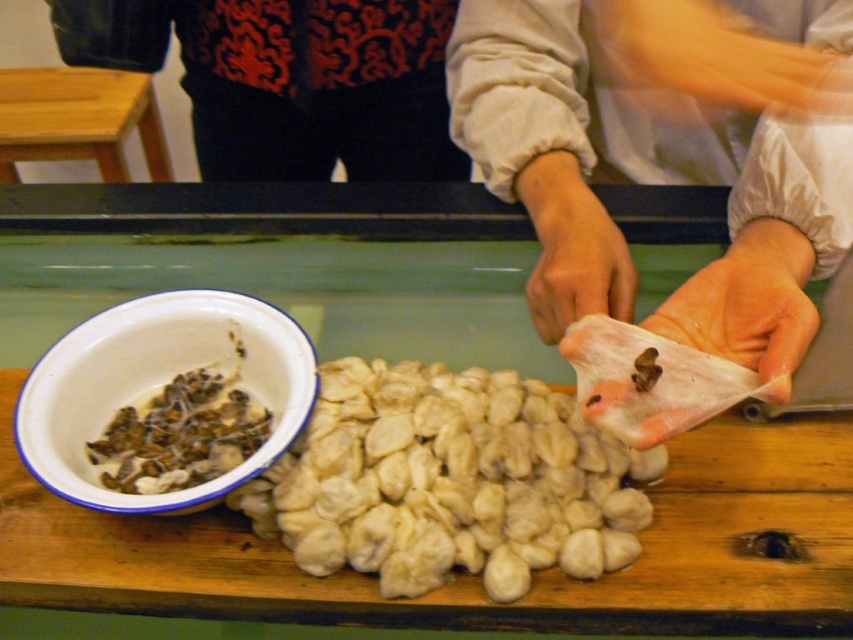
From the picture: You are a food photographer standing 1 meter away from the white enamel bowl at lower left. Can you capture the bowl in your shot without moving your camera?

The white enamel bowl at lower left is 58.75 centimeters away from camera, which is within the 1 meter distance you are standing. Therefore, you can capture the bowl in your shot without moving your camera.

You are a chef standing at the wooden table at left and need to grab the white enamel bowl at lower left to get some filling. Can you reach it without moving your position?

The white enamel bowl at lower left is 1.37 meters away from the wooden table at left. Since the average human arm length is about 0.7 meters, you cannot reach the white enamel bowl at lower left from the wooden table at left without moving.

You are trying to locate the patterned fabric shirt at upper center in the scene. The point given is at coordinates point [289,81]. Can you confirm if this point is within the bounds of the patterned fabric shirt at upper center?

The point [289,81] corresponds to the patterned fabric shirt at upper center, so yes, the point is within its bounds.